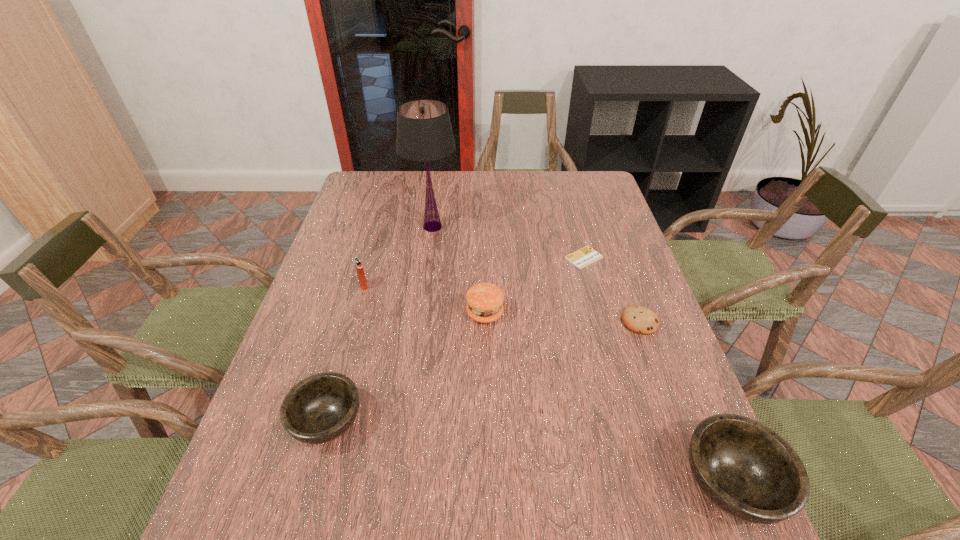
The width and height of the screenshot is (960, 540). Identify the location of vacant region located on the left of the taller bowl. [x=637, y=484].

This screenshot has height=540, width=960. What are the coordinates of `vacant space situated on the front-facing side of the third object from left to right` in the screenshot? It's located at (420, 316).

At what (x,y) coordinates should I click in order to perform the action: click on vacant area situated 0.390m on the back of the shortest object. Please return your answer as a coordinate pair (x, y). This screenshot has height=540, width=960. Looking at the image, I should click on (564, 181).

What are the coordinates of `free spot located on the front of the second shortest object` in the screenshot? It's located at (676, 421).

Find the location of a particular element. The height and width of the screenshot is (540, 960). vacant area located 0.110m on the left of the fifth nearest object is located at coordinates (320, 286).

Where is `free space located on the front of the patty`? free space located on the front of the patty is located at coordinates (486, 369).

Where is `bowl present at the left edge`? bowl present at the left edge is located at coordinates (320, 408).

Image resolution: width=960 pixels, height=540 pixels. Find the location of `igniter that is at the left edge`. igniter that is at the left edge is located at coordinates (358, 263).

Locate an element on the screen. bowl that is at the right edge is located at coordinates (746, 469).

At what (x,y) coordinates should I click in order to perform the action: click on identity card located in the right edge section of the desktop. Please return your answer as a coordinate pair (x, y). The width and height of the screenshot is (960, 540). Looking at the image, I should click on (586, 255).